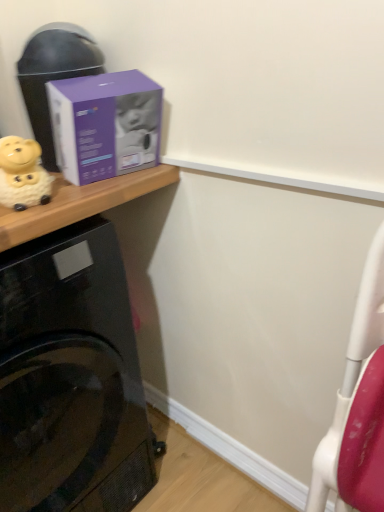
Question: From the image's perspective, is purple cardboard box at upper left above or below purple matte box at upper left?

Choices:
 (A) below
 (B) above

Answer: (B)

Question: Is purple cardboard box at upper left taller or shorter than purple matte box at upper left?

Choices:
 (A) tall
 (B) short

Answer: (A)

Question: Based on their relative distances, which object is farther from the yellow matte piggy bank at left?

Choices:
 (A) purple matte box at upper left
 (B) purple cardboard box at upper left
 (C) black glossy washing machine at lower left

Answer: (C)

Question: Estimate the real-world distances between objects in this image. Which object is closer to the yellow matte piggy bank at left?

Choices:
 (A) purple cardboard box at upper left
 (B) black glossy washing machine at lower left
 (C) purple matte box at upper left

Answer: (C)